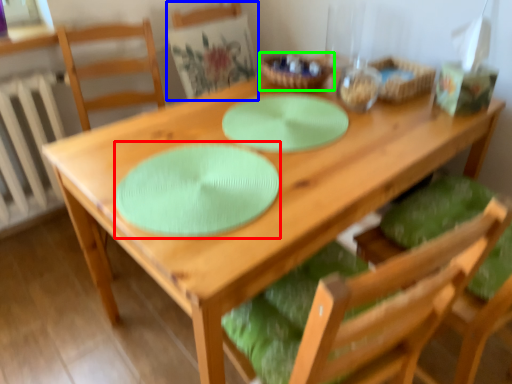
Question: Considering the real-world distances, which object is farthest from paper plate (highlighted by a red box)? chair (highlighted by a blue box) or tableware (highlighted by a green box)?

Choices:
 (A) chair
 (B) tableware

Answer: (A)